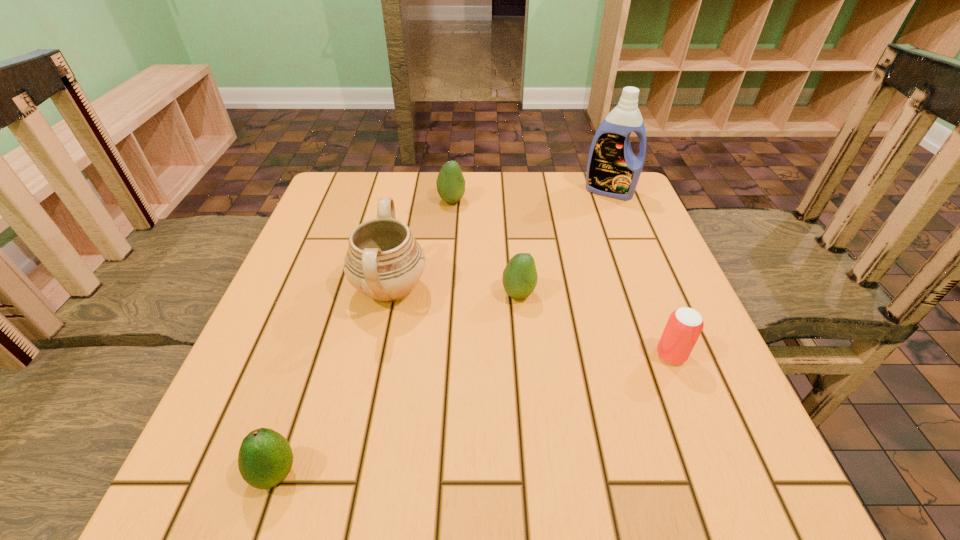
Image resolution: width=960 pixels, height=540 pixels. Identify the location of the tallest object. (613, 170).

What are the coordinates of `the fifth shortest object` in the screenshot? It's located at (383, 261).

Find the location of `the farthest avocado`. the farthest avocado is located at coordinates (450, 182).

This screenshot has height=540, width=960. I want to click on the rightmost avocado, so click(519, 279).

The height and width of the screenshot is (540, 960). What are the coordinates of `the second farthest avocado` in the screenshot? It's located at (519, 279).

Find the location of a particular element. Image resolution: width=960 pixels, height=540 pixels. beer can is located at coordinates (684, 326).

In order to click on the leftmost avocado in this screenshot , I will do `click(265, 458)`.

You are a GUI agent. You are given a task and a screenshot of the screen. Output one action in this format:
    pyautogui.click(x=<x>, y=<y>)
    Task: Click on the nearest object
    The height and width of the screenshot is (540, 960).
    Given the screenshot: What is the action you would take?
    pyautogui.click(x=265, y=458)

The height and width of the screenshot is (540, 960). In order to click on vacant region located on the left of the detergent in this screenshot , I will do `click(523, 191)`.

Find the location of a particular element. free space located on the front-facing side of the urn is located at coordinates (536, 289).